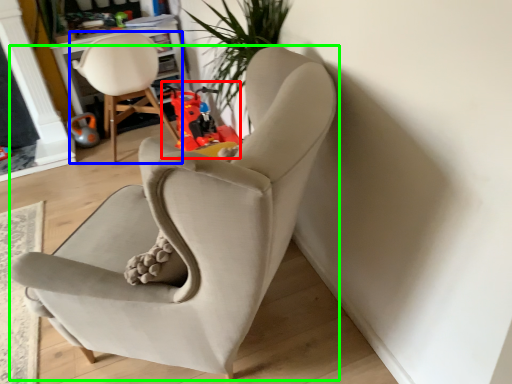
Question: Which object is positioned closest to toy (highlighted by a red box)? Select from chair (highlighted by a blue box) and chair (highlighted by a green box).

Choices:
 (A) chair
 (B) chair

Answer: (A)